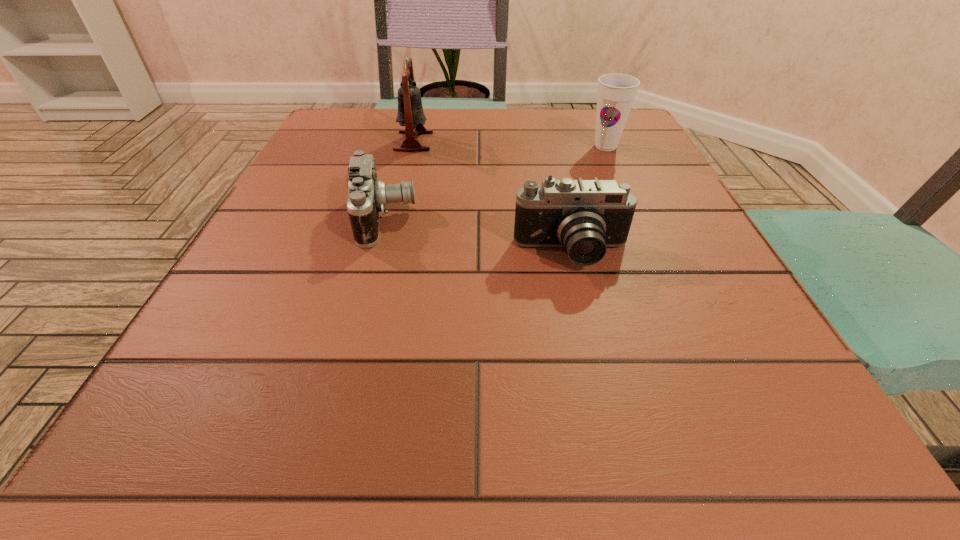
You are a GUI agent. You are given a task and a screenshot of the screen. Output one action in this format:
    pyautogui.click(x=<x>, y=<y>)
    Task: Click on the bell located in the far edge section of the desktop
    The height and width of the screenshot is (540, 960).
    Given the screenshot: What is the action you would take?
    pyautogui.click(x=410, y=114)

What are the coordinates of `cup present at the far edge` in the screenshot? It's located at pos(616,92).

This screenshot has width=960, height=540. Find the location of `object positioned at the left edge`. object positioned at the left edge is located at coordinates tap(367, 196).

Locate an element on the screen. This screenshot has width=960, height=540. cup present at the right edge is located at coordinates (616, 92).

Locate an element on the screen. This screenshot has width=960, height=540. camera located at the right edge is located at coordinates (585, 217).

This screenshot has height=540, width=960. I want to click on object present at the far right corner, so click(616, 92).

Where is `vacant space at the far edge of the desktop`? Image resolution: width=960 pixels, height=540 pixels. vacant space at the far edge of the desktop is located at coordinates (550, 134).

Image resolution: width=960 pixels, height=540 pixels. In the image, there is a desktop. In order to click on vacant area at the near edge in this screenshot , I will do `click(371, 429)`.

Image resolution: width=960 pixels, height=540 pixels. I want to click on free space at the left edge, so click(320, 246).

The image size is (960, 540). Find the location of `blank space at the far left corner of the desktop`. blank space at the far left corner of the desktop is located at coordinates (328, 152).